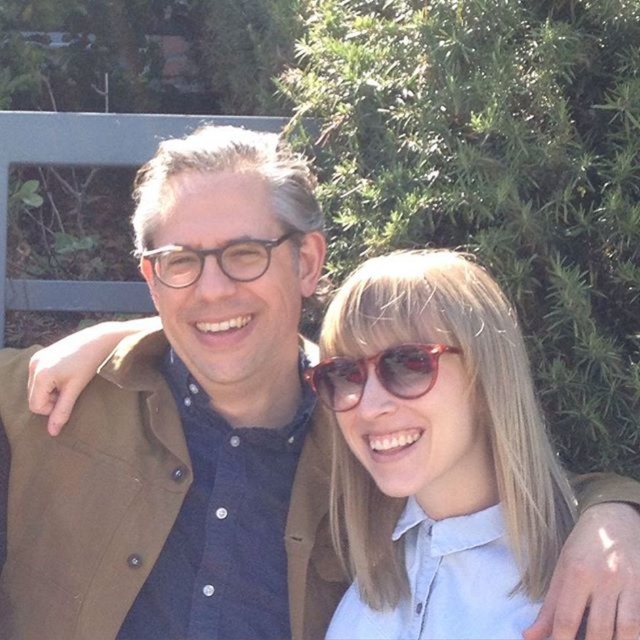
Is matte red sunglasses at center to the right of translucent red sunglasses at center from the viewer's perspective?

Indeed, matte red sunglasses at center is positioned on the right side of translucent red sunglasses at center.

Is point (387, 468) positioned after point (429, 358)?

That is True.

You are a GUI agent. You are given a task and a screenshot of the screen. Output one action in this format:
    pyautogui.click(x=<x>, y=<y>)
    Task: Click on the matte red sunglasses at center
    The width and height of the screenshot is (640, 640).
    Given the screenshot: What is the action you would take?
    pyautogui.click(x=440, y=445)

Is matte red sunglasses at center shorter than matte black glasses at center?

No, matte red sunglasses at center is not shorter than matte black glasses at center.

Between matte red sunglasses at center and matte black glasses at center, which one appears on the left side from the viewer's perspective?

From the viewer's perspective, matte black glasses at center appears more on the left side.

Measure the distance between matte red sunglasses at center and camera.

The distance of matte red sunglasses at center from camera is 1.30 meters.

Where is `matte red sunglasses at center`? This screenshot has height=640, width=640. matte red sunglasses at center is located at coordinates (440, 445).

Does translucent red sunglasses at center come behind matte black glasses at center?

No, translucent red sunglasses at center is in front of matte black glasses at center.

Which is behind, point (355, 381) or point (164, 280)?

The point (164, 280) is behind.

You are a GUI agent. You are given a task and a screenshot of the screen. Output one action in this format:
    pyautogui.click(x=<x>, y=<y>)
    Task: Click on the translucent red sunglasses at center
    The image size is (640, 640).
    Given the screenshot: What is the action you would take?
    pyautogui.click(x=378, y=372)